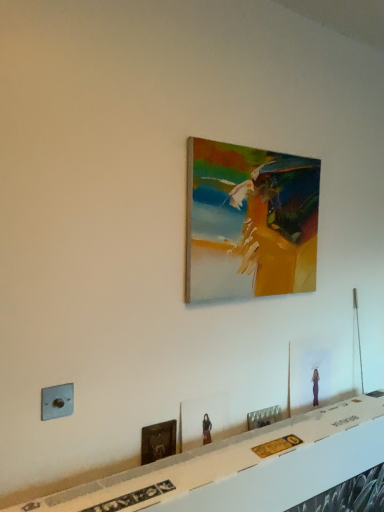
Question: Does wooden picture frame at lower left, positioned as the fourth picture frame in top-to-bottom order, have a smaller size compared to metallic gray electric outlet at lower left?

Choices:
 (A) no
 (B) yes

Answer: (A)

Question: Is metallic gray electric outlet at lower left surrounded by wooden picture frame at lower left, which appears as the second picture frame when ordered from the bottom?

Choices:
 (A) yes
 (B) no

Answer: (B)

Question: From a real-world perspective, is wooden picture frame at lower left, positioned as the fourth picture frame in top-to-bottom order, physically below metallic gray electric outlet at lower left?

Choices:
 (A) no
 (B) yes

Answer: (B)

Question: From the image's perspective, is wooden picture frame at lower left, which appears as the second picture frame when ordered from the bottom, beneath metallic gray electric outlet at lower left?

Choices:
 (A) yes
 (B) no

Answer: (A)

Question: From the image's perspective, is wooden picture frame at lower left, positioned as the fourth picture frame in top-to-bottom order, on top of metallic gray electric outlet at lower left?

Choices:
 (A) no
 (B) yes

Answer: (A)

Question: Can you confirm if wooden picture frame at lower left, positioned as the fourth picture frame in top-to-bottom order, is positioned to the left of metallic gray electric outlet at lower left?

Choices:
 (A) yes
 (B) no

Answer: (B)

Question: Can you confirm if matte glass picture frame at lower right, positioned as the 4th picture frame in bottom-to-top order, is positioned to the right of white glossy table at lower center?

Choices:
 (A) yes
 (B) no

Answer: (A)

Question: Can you confirm if matte glass picture frame at lower right, which is counted as the second picture frame, starting from the top, is positioned to the left of white glossy table at lower center?

Choices:
 (A) no
 (B) yes

Answer: (A)

Question: Is matte glass picture frame at lower right, which is counted as the second picture frame, starting from the top, behind white glossy table at lower center?

Choices:
 (A) yes
 (B) no

Answer: (A)

Question: Is white glossy table at lower center inside matte glass picture frame at lower right, positioned as the 4th picture frame in bottom-to-top order?

Choices:
 (A) no
 (B) yes

Answer: (A)

Question: Can you confirm if matte glass picture frame at lower right, positioned as the 4th picture frame in bottom-to-top order, is thinner than white glossy table at lower center?

Choices:
 (A) no
 (B) yes

Answer: (B)

Question: Does matte glass picture frame at lower right, which is counted as the second picture frame, starting from the top, have a larger size compared to white glossy table at lower center?

Choices:
 (A) yes
 (B) no

Answer: (B)

Question: Does white glossy table at lower center lie behind matte wooden picture frame at center, marked as the third picture frame in a top-to-bottom arrangement?

Choices:
 (A) yes
 (B) no

Answer: (B)